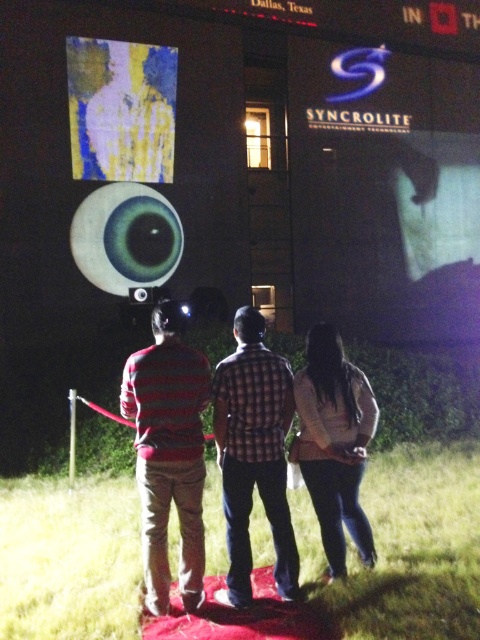
Question: Based on their relative distances, which object is farther from the white matte shirt at center?

Choices:
 (A) plaid shirt at center
 (B) striped sweater at center

Answer: (B)

Question: Which object is positioned farthest from the plaid shirt at center?

Choices:
 (A) striped sweater at center
 (B) white matte shirt at center
 (C) yellow fabric at upper left

Answer: (C)

Question: Which object appears closest to the camera in this image?

Choices:
 (A) white matte shirt at center
 (B) plaid shirt at center
 (C) striped sweater at center
 (D) yellow fabric at upper left

Answer: (C)

Question: Does striped sweater at center have a larger size compared to white matte shirt at center?

Choices:
 (A) no
 (B) yes

Answer: (B)

Question: Is yellow fabric at upper left thinner than white matte shirt at center?

Choices:
 (A) no
 (B) yes

Answer: (A)

Question: Is plaid shirt at center wider than yellow fabric at upper left?

Choices:
 (A) yes
 (B) no

Answer: (B)